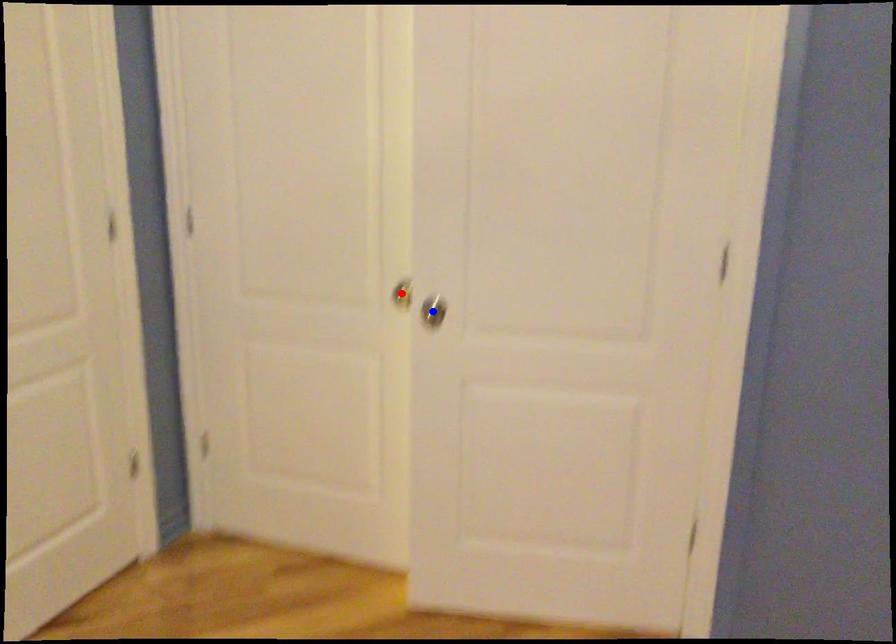
Question: Which of the two points in the image is closer to the camera?

Choices:
 (A) Blue point is closer.
 (B) Red point is closer.

Answer: (A)